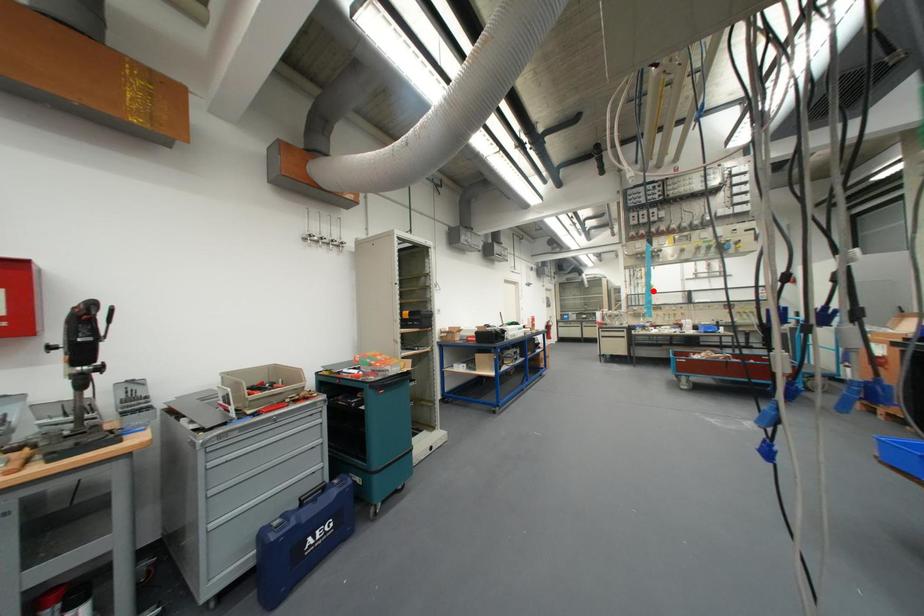
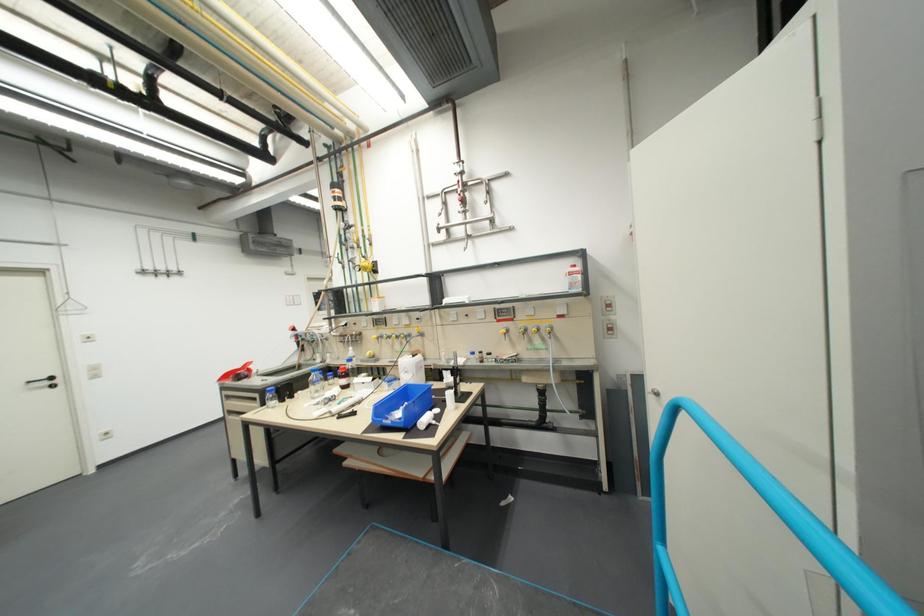
Locate, in the second image, the point that corresponds to the highlighted location in the first image.

(373, 278)